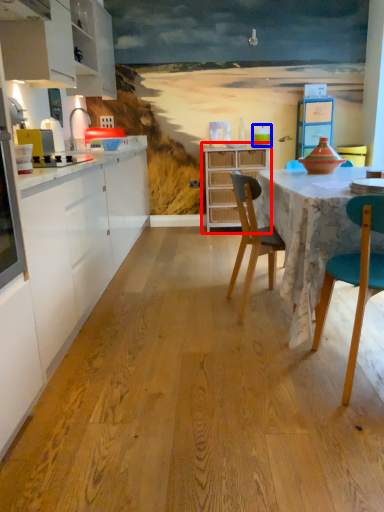
Question: Among these objects, which one is nearest to the camera, cupboard (highlighted by a red box) or teal (highlighted by a blue box)?

Choices:
 (A) cupboard
 (B) teal

Answer: (A)